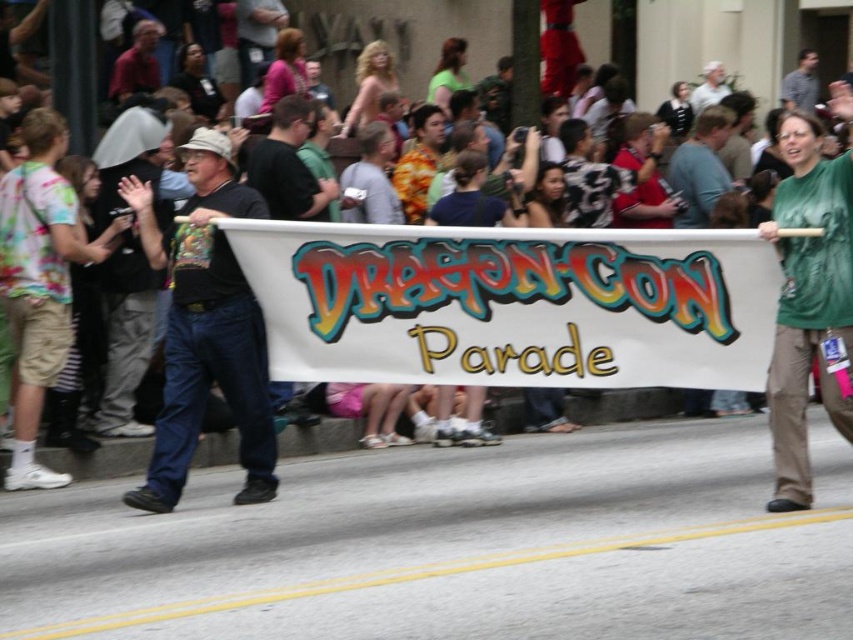
Is point (241, 305) positioned after point (781, 444)?

Yes, it is behind point (781, 444).

Is point (181, 253) closer to camera compared to point (816, 218)?

No, it is behind (816, 218).

Find the location of a particular element. black t-shirt at left is located at coordinates (206, 328).

Which is in front, point (199, 147) or point (709, 68)?

Point (199, 147) is in front.

Can you confirm if black t-shirt at left is positioned above gray fabric hat at upper center?

No.

Which is behind, point (187, 369) or point (697, 102)?

Positioned behind is point (697, 102).

At what (x,y) coordinates should I click in order to perform the action: click on black t-shirt at left. Please return your answer as a coordinate pair (x, y). Looking at the image, I should click on (206, 328).

Is green fabric shirt at center closer to the viewer compared to gray shirt at center?

Yes, green fabric shirt at center is in front of gray shirt at center.

The width and height of the screenshot is (853, 640). I want to click on green fabric shirt at center, so click(x=809, y=304).

Where is `green fabric shirt at center`? This screenshot has width=853, height=640. green fabric shirt at center is located at coordinates (809, 304).